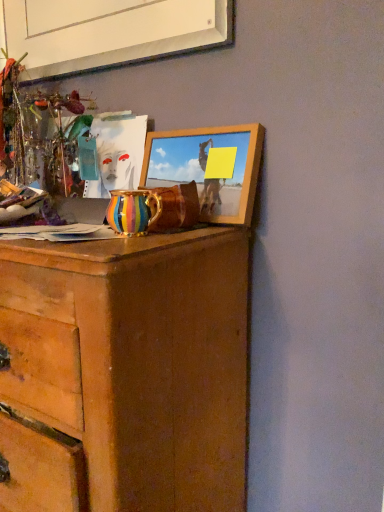
Question: Is wooden picture frame at upper center, arranged as the 1th picture frame when ordered from the bottom, completely or partially outside of white matte picture frame at upper center, the 1th picture frame from the top?

Choices:
 (A) yes
 (B) no

Answer: (A)

Question: From a real-world perspective, is wooden picture frame at upper center, arranged as the 1th picture frame when ordered from the bottom, on white matte picture frame at upper center, which is counted as the second picture frame, starting from the bottom?

Choices:
 (A) yes
 (B) no

Answer: (B)

Question: Can you confirm if wooden picture frame at upper center, which is counted as the second picture frame, starting from the top, is bigger than white matte picture frame at upper center, which is counted as the second picture frame, starting from the bottom?

Choices:
 (A) yes
 (B) no

Answer: (B)

Question: Can you confirm if wooden picture frame at upper center, which is counted as the second picture frame, starting from the top, is thinner than white matte picture frame at upper center, which is counted as the second picture frame, starting from the bottom?

Choices:
 (A) no
 (B) yes

Answer: (A)

Question: Considering the relative sizes of wooden picture frame at upper center, which is counted as the second picture frame, starting from the top, and white matte picture frame at upper center, which is counted as the second picture frame, starting from the bottom, in the image provided, is wooden picture frame at upper center, which is counted as the second picture frame, starting from the top, shorter than white matte picture frame at upper center, which is counted as the second picture frame, starting from the bottom,?

Choices:
 (A) yes
 (B) no

Answer: (B)

Question: From a real-world perspective, is wooden picture frame at upper center, which is counted as the second picture frame, starting from the top, physically located above or below wooden chest of drawers at center?

Choices:
 (A) above
 (B) below

Answer: (A)

Question: In terms of size, does wooden picture frame at upper center, which is counted as the second picture frame, starting from the top, appear bigger or smaller than wooden chest of drawers at center?

Choices:
 (A) small
 (B) big

Answer: (A)

Question: In the image, is wooden picture frame at upper center, arranged as the 1th picture frame when ordered from the bottom, on the left side or the right side of wooden chest of drawers at center?

Choices:
 (A) left
 (B) right

Answer: (B)

Question: From the image's perspective, is wooden picture frame at upper center, arranged as the 1th picture frame when ordered from the bottom, above or below wooden chest of drawers at center?

Choices:
 (A) above
 (B) below

Answer: (A)

Question: Looking at their shapes, would you say wooden chest of drawers at center is wider or thinner than white matte picture frame at upper center, which is counted as the second picture frame, starting from the bottom?

Choices:
 (A) thin
 (B) wide

Answer: (B)

Question: Is wooden chest of drawers at center in front of or behind white matte picture frame at upper center, which is counted as the second picture frame, starting from the bottom, in the image?

Choices:
 (A) front
 (B) behind

Answer: (A)

Question: Is point (130, 467) positioned closer to the camera than point (139, 31)?

Choices:
 (A) farther
 (B) closer

Answer: (B)

Question: From the image's perspective, relative to white matte picture frame at upper center, the 1th picture frame from the top, is wooden chest of drawers at center above or below?

Choices:
 (A) above
 (B) below

Answer: (B)

Question: Is point (16, 241) closer or farther from the camera than point (114, 189)?

Choices:
 (A) farther
 (B) closer

Answer: (B)

Question: Is wooden chest of drawers at center wider or thinner than multicolored ceramic vase at center?

Choices:
 (A) wide
 (B) thin

Answer: (A)